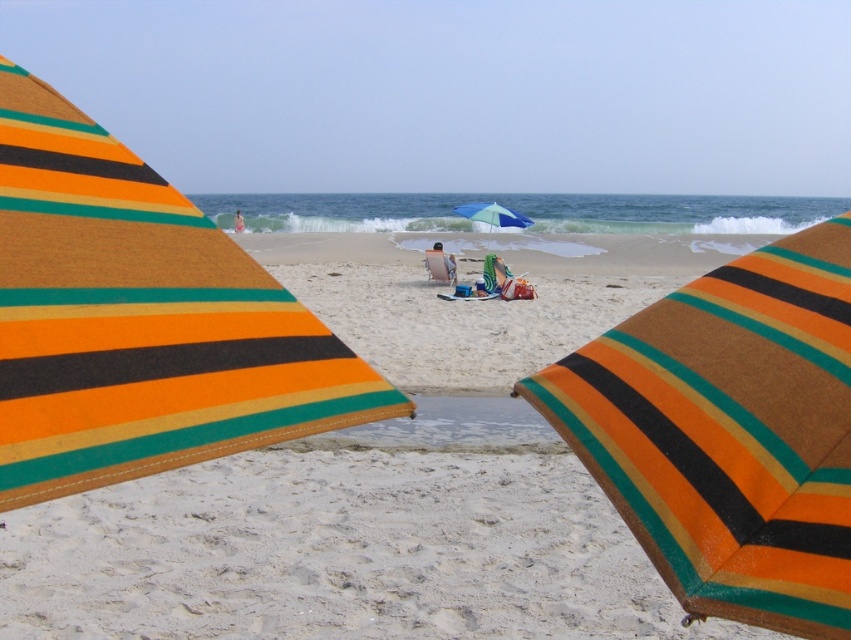
Question: Which of the following is the closest to the observer?

Choices:
 (A) blue fabric umbrella at center
 (B) orange striped towel at center
 (C) matte striped umbrella at center
 (D) gray fabric chair at center

Answer: (B)

Question: Which point appears closest to the camera in this image?

Choices:
 (A) (443, 253)
 (B) (238, 225)

Answer: (A)

Question: Is gray fabric chair at center bigger than skinny pink swimwear at center?

Choices:
 (A) yes
 (B) no

Answer: (B)

Question: Does orange striped towel at center have a larger size compared to beige fabric beach chair at center?

Choices:
 (A) no
 (B) yes

Answer: (A)

Question: Among these points, which one is farthest from the camera?

Choices:
 (A) (438, 269)
 (B) (267, 381)

Answer: (A)

Question: Can you confirm if orange striped towel at center is wider than blue fabric umbrella at center?

Choices:
 (A) no
 (B) yes

Answer: (B)